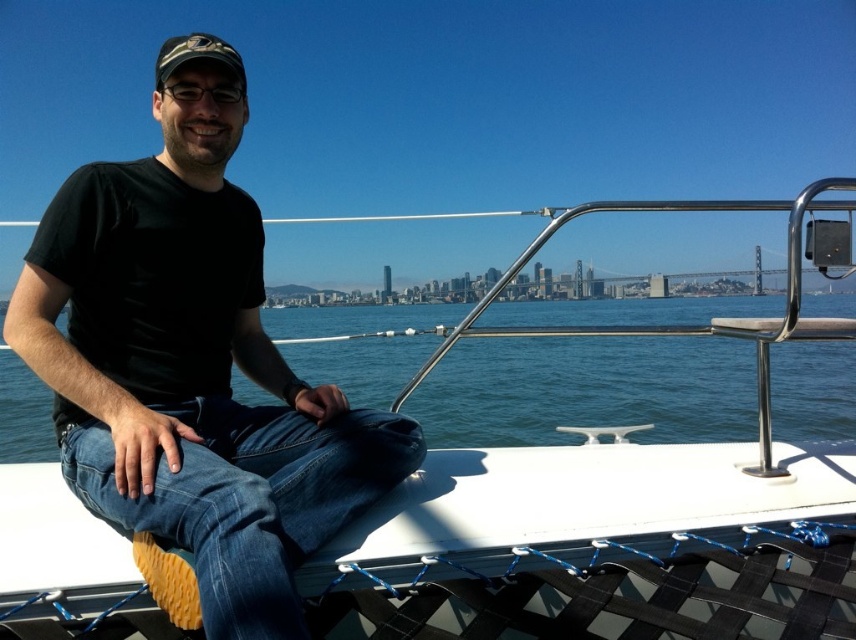
Question: Which of the following is the farthest from the observer?

Choices:
 (A) (789, 388)
 (B) (97, 404)
 (C) (423, 628)

Answer: (A)

Question: Which of the following is the farthest from the observer?

Choices:
 (A) (224, 65)
 (B) (324, 445)
 (C) (531, 392)

Answer: (C)

Question: Which object appears closest to the camera in this image?

Choices:
 (A) blue water at center
 (B) white matte boat at center

Answer: (B)

Question: Where is black matte t-shirt at upper left located in relation to camouflage fabric baseball cap at upper left in the image?

Choices:
 (A) left
 (B) right

Answer: (B)

Question: In this image, where is blue water at center located relative to camouflage fabric baseball cap at upper left?

Choices:
 (A) above
 (B) below

Answer: (B)

Question: Is black matte t-shirt at upper left behind blue water at center?

Choices:
 (A) no
 (B) yes

Answer: (A)